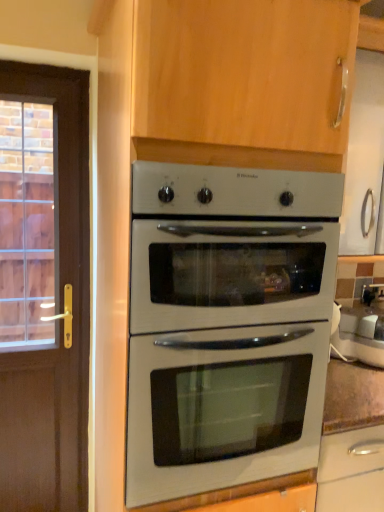
Question: Does white glossy kettle at right lie behind white glossy oven at center?

Choices:
 (A) no
 (B) yes

Answer: (B)

Question: Is white glossy kettle at right shorter than white glossy oven at center?

Choices:
 (A) no
 (B) yes

Answer: (B)

Question: Is white glossy kettle at right touching white glossy oven at center?

Choices:
 (A) yes
 (B) no

Answer: (B)

Question: Considering the relative positions of white glossy kettle at right and white glossy oven at center in the image provided, is white glossy kettle at right to the left of white glossy oven at center from the viewer's perspective?

Choices:
 (A) yes
 (B) no

Answer: (B)

Question: Is white glossy kettle at right to the right of white glossy oven at center from the viewer's perspective?

Choices:
 (A) no
 (B) yes

Answer: (B)

Question: Is white glossy oven at center completely or partially inside white glossy kettle at right?

Choices:
 (A) yes
 (B) no

Answer: (B)

Question: Is white glossy oven at center oriented towards white glossy kettle at right?

Choices:
 (A) yes
 (B) no

Answer: (B)

Question: Can you confirm if white glossy oven at center is smaller than white glossy kettle at right?

Choices:
 (A) no
 (B) yes

Answer: (A)

Question: Considering the relative sizes of white glossy oven at center and white glossy kettle at right in the image provided, is white glossy oven at center shorter than white glossy kettle at right?

Choices:
 (A) yes
 (B) no

Answer: (B)

Question: Considering the relative positions of white glossy oven at center and white glossy kettle at right in the image provided, is white glossy oven at center to the right of white glossy kettle at right from the viewer's perspective?

Choices:
 (A) no
 (B) yes

Answer: (A)

Question: Are white glossy oven at center and white glossy kettle at right far apart?

Choices:
 (A) yes
 (B) no

Answer: (B)

Question: From a real-world perspective, is white glossy oven at center on top of white glossy kettle at right?

Choices:
 (A) no
 (B) yes

Answer: (B)

Question: Choose the correct answer: Is white glossy kettle at right inside white glossy oven at center or outside it?

Choices:
 (A) inside
 (B) outside

Answer: (B)